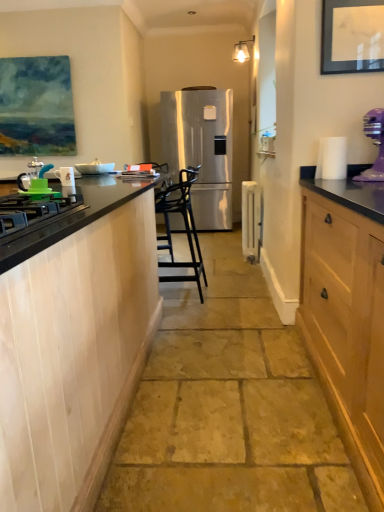
In order to click on free point to the right of black metal bar stool at center in this screenshot , I will do `click(236, 295)`.